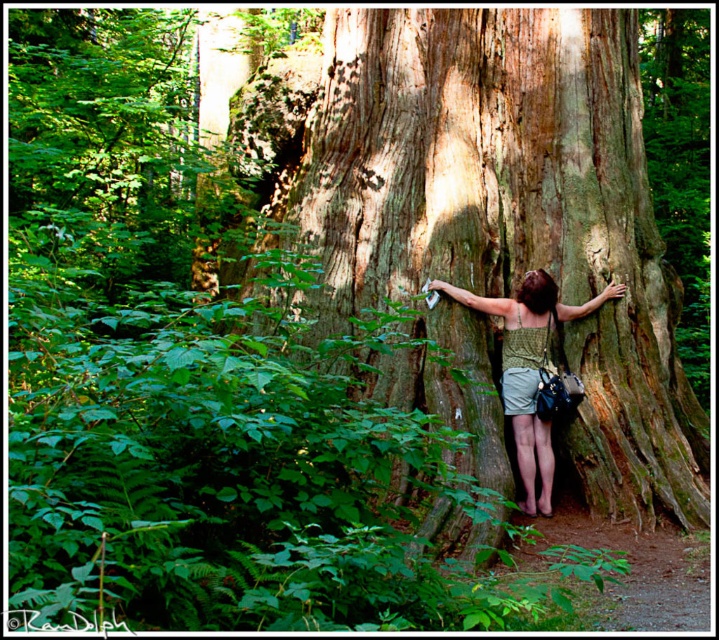
You are a photographer trying to capture the interaction between the smooth brown bark at center and the green textured dress at center. Based on their positions, which one should you focus on first to ensure both are in the frame without moving the camera?

The smooth brown bark at center is above the green textured dress at center, so you should focus on the smooth brown bark at center first to ensure both are in the frame without moving the camera.

You are a photographer trying to capture both the smooth brown bark at center and the green textured dress at center in a single frame. Since the camera has a limited focus range, which object should you prioritize focusing on to ensure it appears clearer in the photo?

The smooth brown bark at center should be prioritized for focus because it is wider than the green textured dress at center, making it more prominent in the frame.